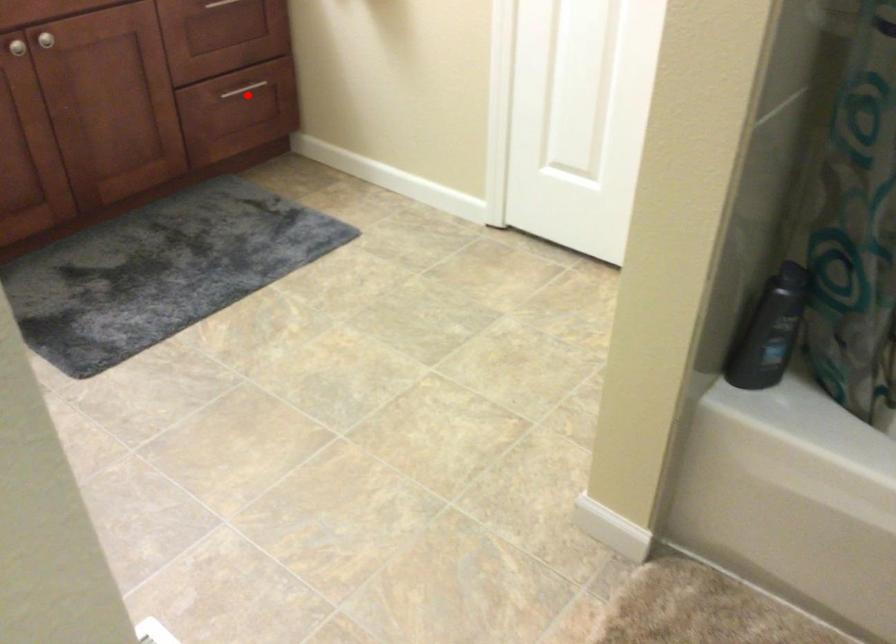
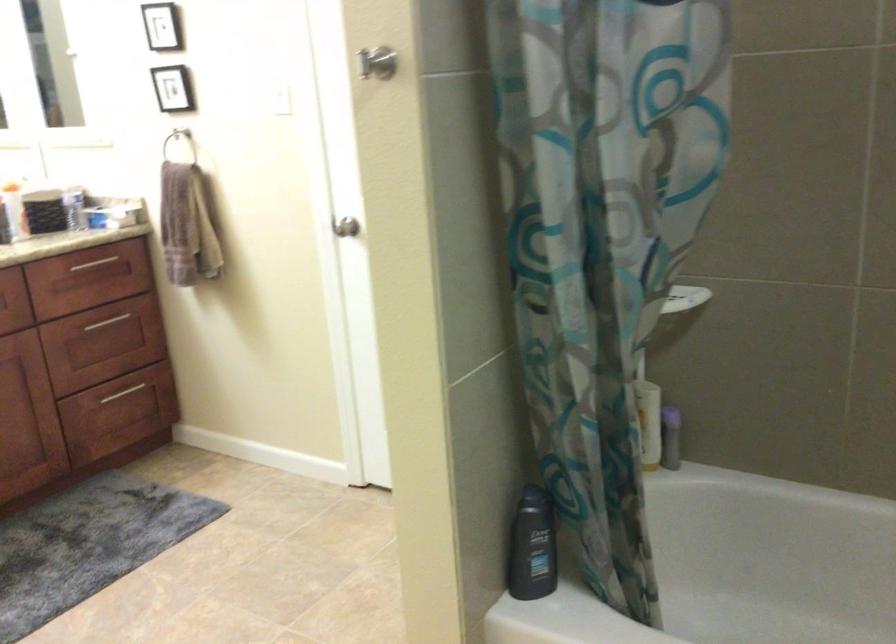
Question: I am providing you with two images of the same scene from different viewpoints. Image1 has a red point marked. In image2, the corresponding 3D location appears at what relative position? Reply with the corresponding letter.

Choices:
 (A) Closer
 (B) Farther

Answer: (B)